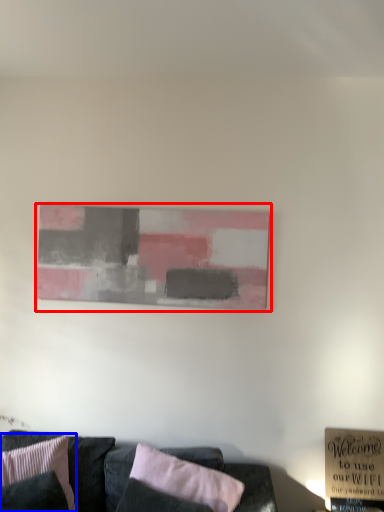
Question: Which point is further to the camera, picture frame (highlighted by a red box) or pillow (highlighted by a blue box)?

Choices:
 (A) picture frame
 (B) pillow

Answer: (A)